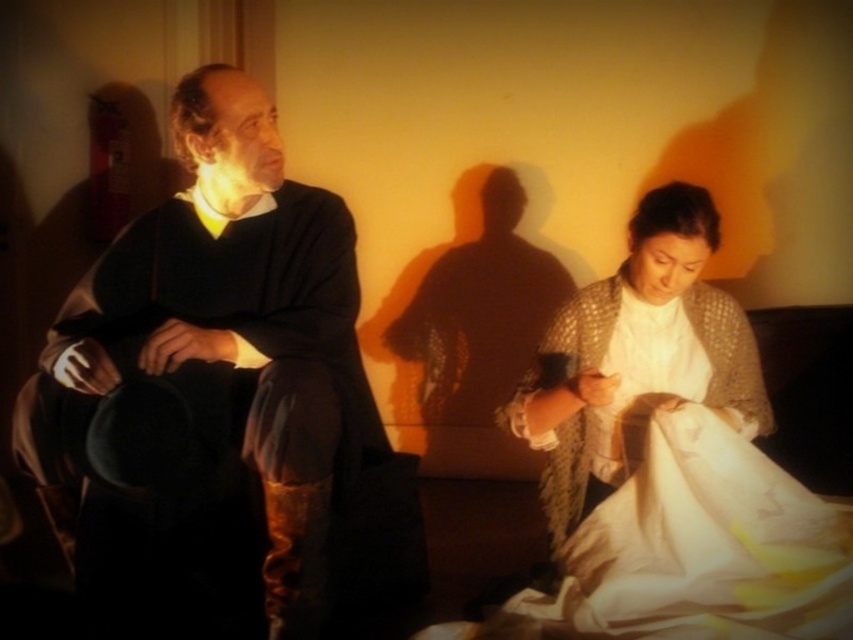
Question: Does matte black hat at left have a smaller size compared to white textured shawl at lower right?

Choices:
 (A) no
 (B) yes

Answer: (A)

Question: Which point is closer to the camera?

Choices:
 (A) white textured shawl at lower right
 (B) matte black hat at left

Answer: (B)

Question: Which object appears closest to the camera in this image?

Choices:
 (A) white textured shawl at lower right
 (B) matte black hat at left

Answer: (B)

Question: Which point is farther to the camera?

Choices:
 (A) (306, 467)
 (B) (701, 300)

Answer: (B)

Question: Does matte black hat at left have a smaller size compared to white textured shawl at lower right?

Choices:
 (A) no
 (B) yes

Answer: (A)

Question: Does matte black hat at left appear on the left side of white textured shawl at lower right?

Choices:
 (A) yes
 (B) no

Answer: (A)